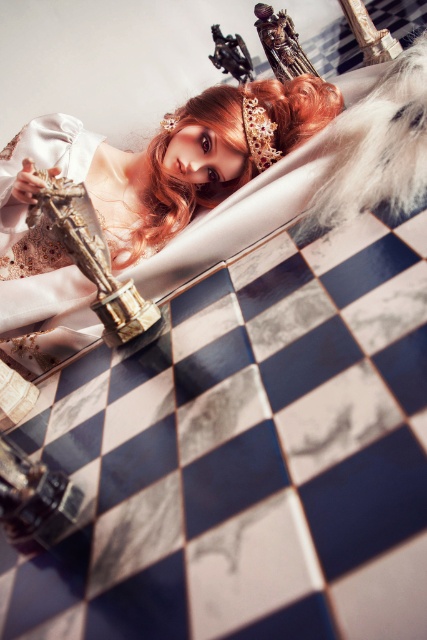
You are a photographer standing in front of the scene. You want to take a photo focusing on the blonde silky hair at center. However, the satin white dress at center is blocking your view. Can you adjust your position to capture the hair without the dress obstructing it?

The satin white dress at center is in front of the blonde silky hair at center, so you cannot directly see the hair from your current position. To capture the hair without obstruction, you would need to move your camera angle or position to either side so that the dress no longer blocks the view.

You are a photographer taking a closeup shot of the person in the image. You need to ensure that both the satin white dress at center and the blonde silky hair at center are clearly visible in the frame. Given their sizes, which object should you focus on to ensure both are in focus?

The satin white dress at center is larger than the blonde silky hair at center, so focusing on the dress will help ensure both are in focus as the hair is smaller and closer to the dress in the frame.

You are a photographer taking a picture of the scene. You need to focus on the two points labeled as point [40,266] and point [129,248]. Which point should you focus on first to ensure both are in focus?

You should focus on point [40,266] first because it is closer to the camera than point [129,248]. This ensures the depth of field will cover both points effectively.